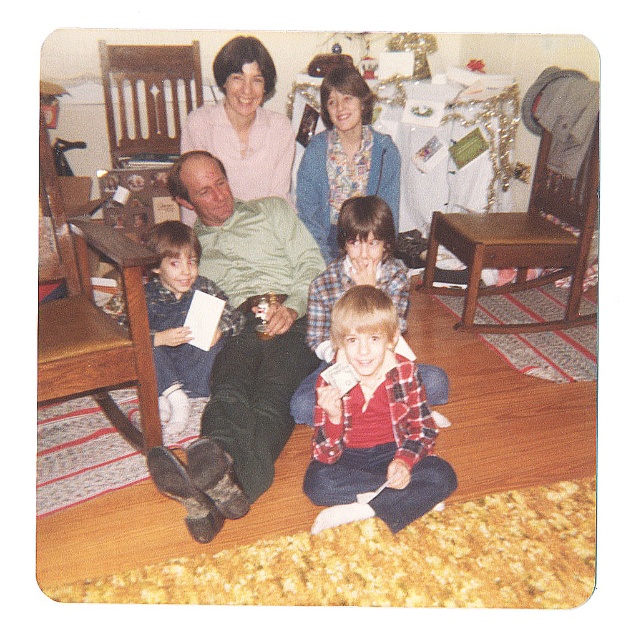
Is flannel shirt at center closer to the viewer compared to light pink fabric at upper center?

Yes, flannel shirt at center is closer to the viewer.

Between flannel shirt at center and light pink fabric at upper center, which one has more height?

flannel shirt at center

Locate an element on the screen. The height and width of the screenshot is (640, 626). flannel shirt at center is located at coordinates (372, 426).

Consider the image. Which is more to the left, matte green sweater at center or green wool sweater at center?

From the viewer's perspective, matte green sweater at center appears more on the left side.

Is matte green sweater at center above green wool sweater at center?

Correct, matte green sweater at center is located above green wool sweater at center.

Which is in front, point (274, 449) or point (305, 257)?

Point (274, 449)

Identify the location of matte green sweater at center. (239, 308).

Which is in front, point (309, 189) or point (218, 339)?

Point (218, 339) is more forward.

Which is above, blue textured sweater at upper center or blue knit sweater at left?

Positioned higher is blue textured sweater at upper center.

Between point (329, 211) and point (170, 371), which one is positioned in front?

Point (170, 371) is in front.

You are a GUI agent. You are given a task and a screenshot of the screen. Output one action in this format:
    pyautogui.click(x=<x>, y=<y>)
    Task: Click on the blue textured sweater at upper center
    
    Given the screenshot: What is the action you would take?
    point(344,160)